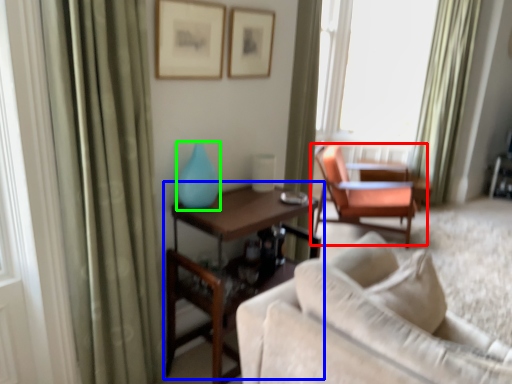
Question: Based on their relative distances, which object is farther from chair (highlighted by a red box)? Choose from table (highlighted by a blue box) and turquoise (highlighted by a green box).

Choices:
 (A) table
 (B) turquoise

Answer: (B)